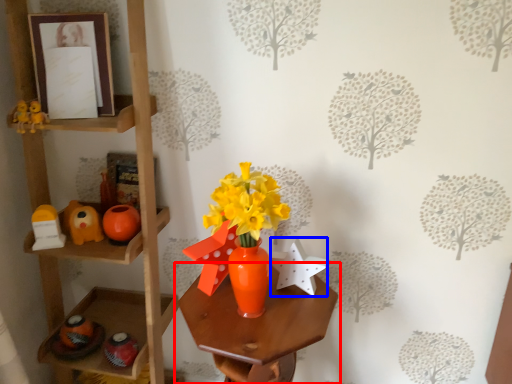
Question: Among these objects, which one is nearest to the camera, table (highlighted by a red box) or toy (highlighted by a blue box)?

Choices:
 (A) table
 (B) toy

Answer: (A)